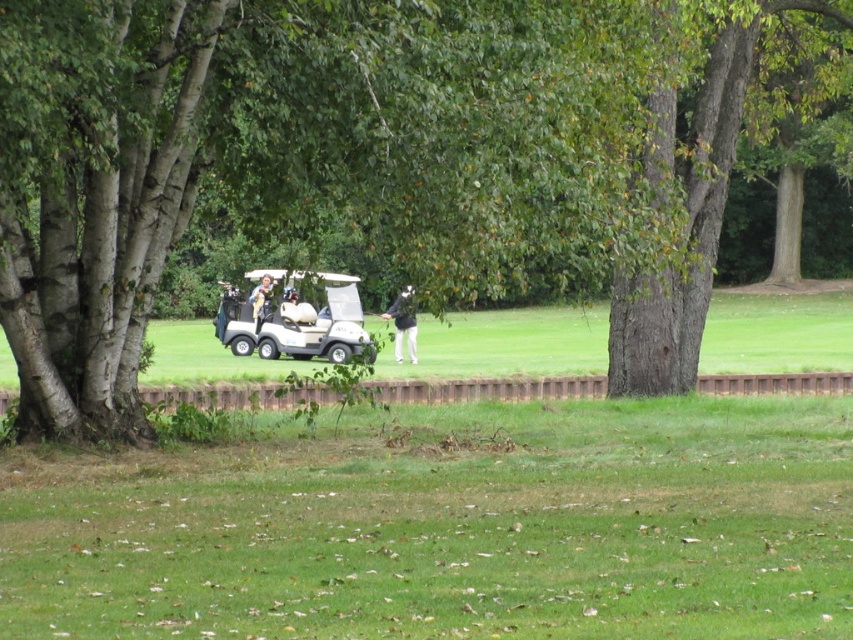
Question: Is brown textured tree at center above white matte golf cart at center?

Choices:
 (A) yes
 (B) no

Answer: (A)

Question: Considering the real-world distances, which object is farthest from the white matte golf cart at center?

Choices:
 (A) brown textured tree at center
 (B) light brown leather jacket at center

Answer: (A)

Question: Which object is farther from the camera taking this photo?

Choices:
 (A) white matte golf cart at center
 (B) dark gray pants at center
 (C) light brown leather jacket at center

Answer: (C)

Question: Estimate the real-world distances between objects in this image. Which object is farther from the dark gray pants at center?

Choices:
 (A) brown textured tree at center
 (B) white matte golf cart at center
 (C) light brown leather jacket at center

Answer: (C)

Question: Is brown textured tree at center below dark gray pants at center?

Choices:
 (A) yes
 (B) no

Answer: (B)

Question: Where is brown textured tree at center located in relation to white matte golf cart at center in the image?

Choices:
 (A) above
 (B) below

Answer: (A)